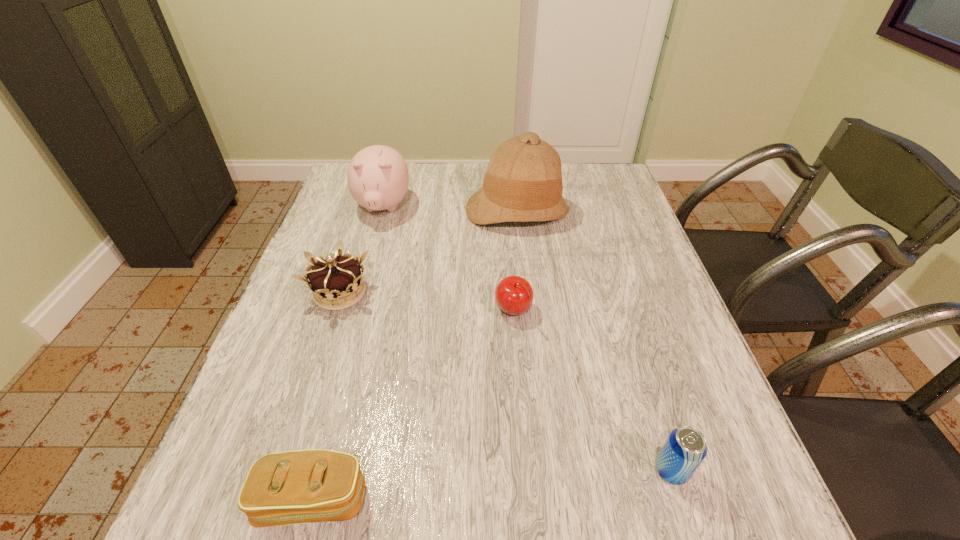
Identify the location of object that is at the near left corner. The image size is (960, 540). (292, 487).

Locate an element on the screen. object present at the near right corner is located at coordinates (685, 448).

Where is `vacant region at the far edge of the desktop`? vacant region at the far edge of the desktop is located at coordinates (415, 171).

This screenshot has width=960, height=540. What are the coordinates of `free region at the near edge of the desktop` in the screenshot? It's located at 622,498.

In the image, there is a desktop. In order to click on vacant area at the left edge in this screenshot , I will do `click(244, 478)`.

At what (x,y) coordinates should I click in order to perform the action: click on vacant space at the right edge of the desktop. Please return your answer as a coordinate pair (x, y). The image size is (960, 540). Looking at the image, I should click on (721, 471).

Identify the location of free spot at the far right corner of the desktop. (599, 190).

Find the location of `vacant space at the near right corner of the desktop`. vacant space at the near right corner of the desktop is located at coordinates (679, 487).

Identify the location of vacant space that is in between the crown and the hat. (428, 252).

This screenshot has width=960, height=540. What are the coordinates of `free space between the shortest object and the rightmost object` in the screenshot? It's located at (492, 485).